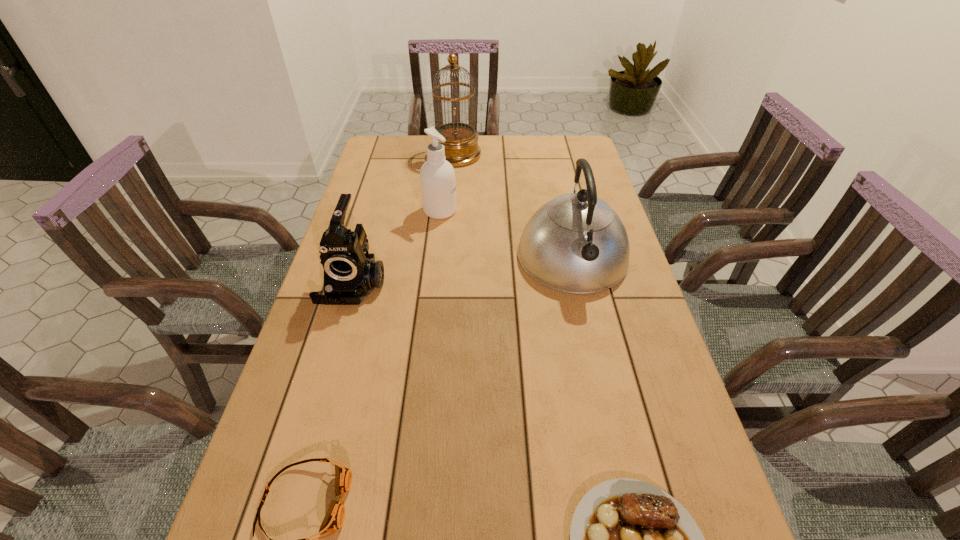
The height and width of the screenshot is (540, 960). I want to click on the tallest object, so click(x=461, y=147).

Identify the location of the farthest object. This screenshot has width=960, height=540. (461, 147).

Locate an element on the screen. The height and width of the screenshot is (540, 960). kettle is located at coordinates (576, 243).

Identify the location of the fifth nearest object. This screenshot has height=540, width=960. (437, 176).

Where is `camcorder`? camcorder is located at coordinates (350, 274).

At what (x,y) coordinates should I click in order to perform the action: click on free region located with an open door on the farthest object. Please return your answer as a coordinate pair (x, y). This screenshot has width=960, height=540. Looking at the image, I should click on click(507, 155).

The image size is (960, 540). I want to click on blank space located 0.330m from the spout of the kettle, so click(x=609, y=416).

The width and height of the screenshot is (960, 540). I want to click on blank space located on the front label of the second farthest object, so click(546, 211).

Where is `vacant space located on the lens mount of the third shortest object`? vacant space located on the lens mount of the third shortest object is located at coordinates (311, 429).

Identify the location of object that is at the far edge. This screenshot has width=960, height=540. (461, 147).